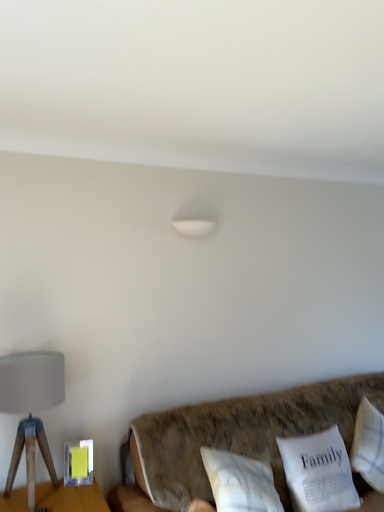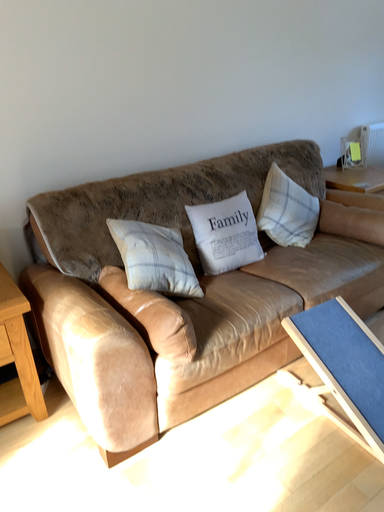
Question: Which way did the camera rotate in the video?

Choices:
 (A) rotated downward
 (B) rotated upward

Answer: (A)